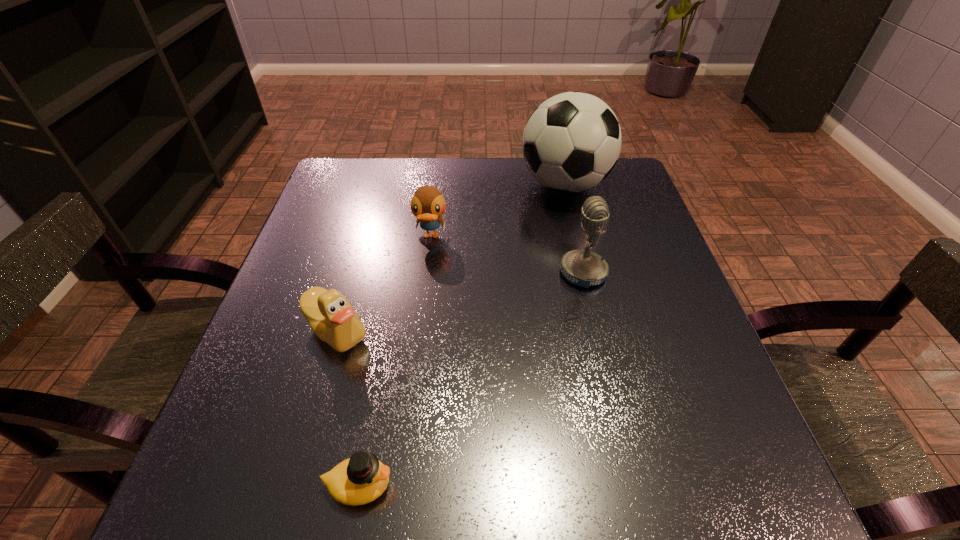
You are a GUI agent. You are given a task and a screenshot of the screen. Output one action in this format:
    pyautogui.click(x=<x>, y=<y>)
    Task: Click on the free space between the farthest duck and the tallest object
    This screenshot has width=960, height=540.
    Given the screenshot: What is the action you would take?
    pyautogui.click(x=497, y=211)

Locate an element on the screen. The width and height of the screenshot is (960, 540). free space between the nearest object and the tallest object is located at coordinates (462, 335).

Locate an element on the screen. The height and width of the screenshot is (540, 960). vacant space in between the fourth nearest object and the tallest object is located at coordinates (497, 211).

Find the location of a particular element. free spot between the soccer ball and the nearest duck is located at coordinates (462, 335).

Identify the location of vacant area that lies between the fourth nearest object and the shortest duck. (395, 361).

The image size is (960, 540). In order to click on unoccupied position between the shortest object and the fourth nearest object in this screenshot , I will do `click(395, 361)`.

Find the location of `unoccupied area between the fourth nearest object and the fourth farthest object`. unoccupied area between the fourth nearest object and the fourth farthest object is located at coordinates (384, 284).

Identify which object is the second nearest to the third farthest object. Please provide its 2D coordinates. Your answer should be formatted as a tuple, i.e. [(x, y)], where the tuple contains the x and y coordinates of a point satisfying the conditions above.

[(428, 204)]

Locate which object ranks in proximity to the shortest duck. Please provide its 2D coordinates. Your answer should be formatted as a tuple, i.e. [(x, y)], where the tuple contains the x and y coordinates of a point satisfying the conditions above.

[(331, 317)]

This screenshot has height=540, width=960. Find the location of `the third closest duck to the farthest object`. the third closest duck to the farthest object is located at coordinates [x=361, y=479].